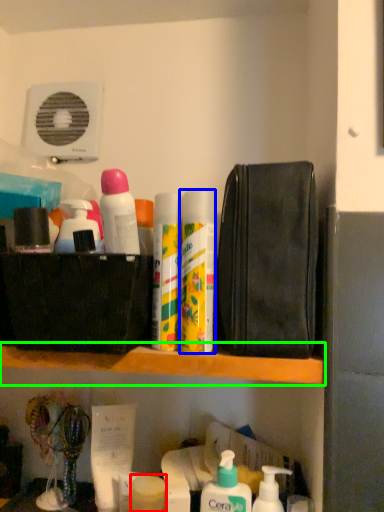
Question: Considering the real-world distances, which object is farthest from toiletry (highlighted by a red box)? cleaning product (highlighted by a blue box) or shelf (highlighted by a green box)?

Choices:
 (A) cleaning product
 (B) shelf

Answer: (A)